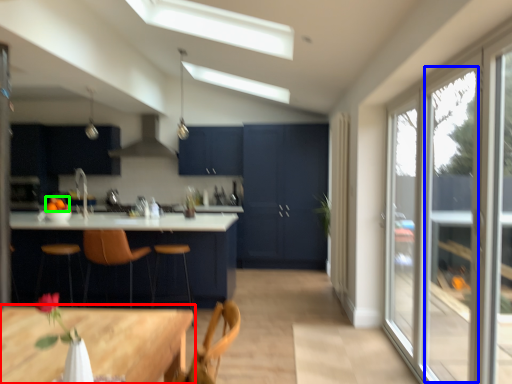
Question: Considering the real-world distances, which object is farthest from table (highlighted by a red box)? window (highlighted by a blue box) or fruit (highlighted by a green box)?

Choices:
 (A) window
 (B) fruit

Answer: (B)